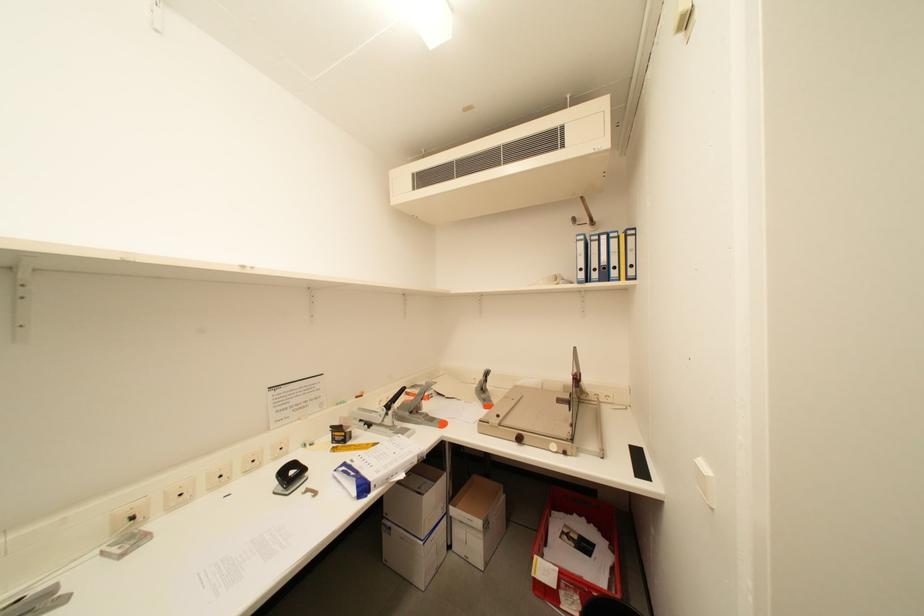
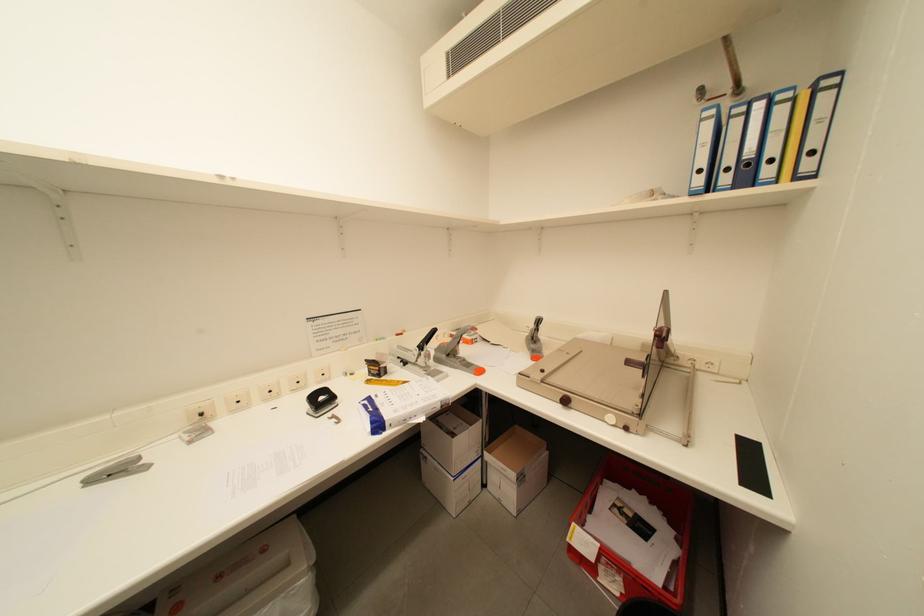
In a continuous first-person perspective shot, in which direction is the camera moving?

The cameraman moved toward right, forward.